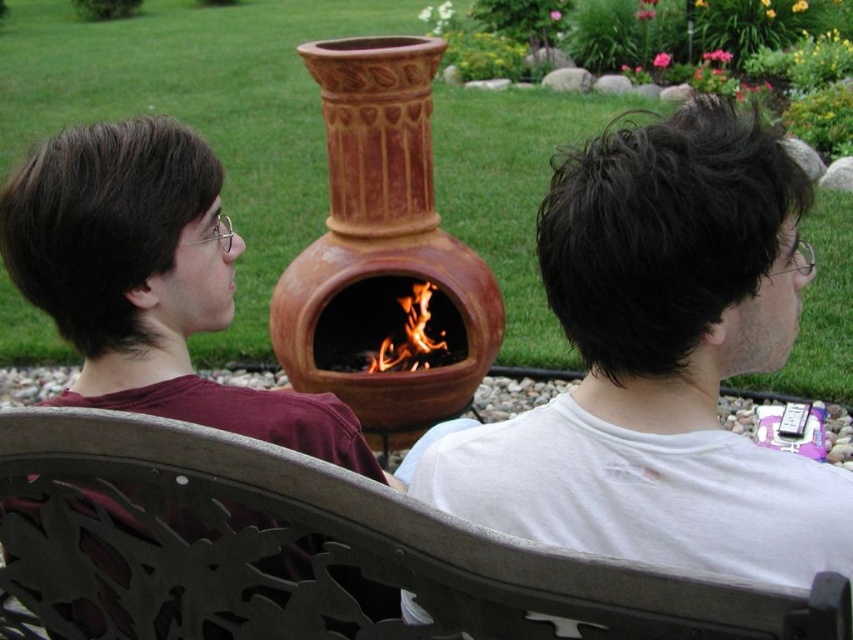
You are a photographer wanting to capture the two people sitting on the metal bench while ensuring the flamewoodenfire at center and terracotta clay fireplace at center are both visible in the frame. Which object should you place closer to the camera to ensure both are in the shot?

The terracotta clay fireplace at center is positioned on the left side of flamewoodenfire at center, so to include both in the frame, you should position yourself closer to the flamewoodenfire at center. This way, both the terracotta clay fireplace at center and the flamewoodenfire at center will be visible in the shot.

You are standing at the camera position and want to sit down on the metallic gray chair at lower center. Can you reach the chair without moving more than 5 feet forward?

The metallic gray chair at lower center and the camera are 4.97 feet apart, so yes, you can reach the chair without moving more than 5 feet forward since the distance is just under 5 feet.

You are a photographer aiming to capture the entire scene of the terracotta clay fireplace at center and the flamewoodenfire at center in one shot. Given that your camera has a fixed focal length, which object should you position closer to the camera to ensure both are fully visible?

Since the terracotta clay fireplace at center is larger than the flamewoodenfire at center, you should position the terracotta clay fireplace at center closer to the camera to ensure both objects fit within the frame.